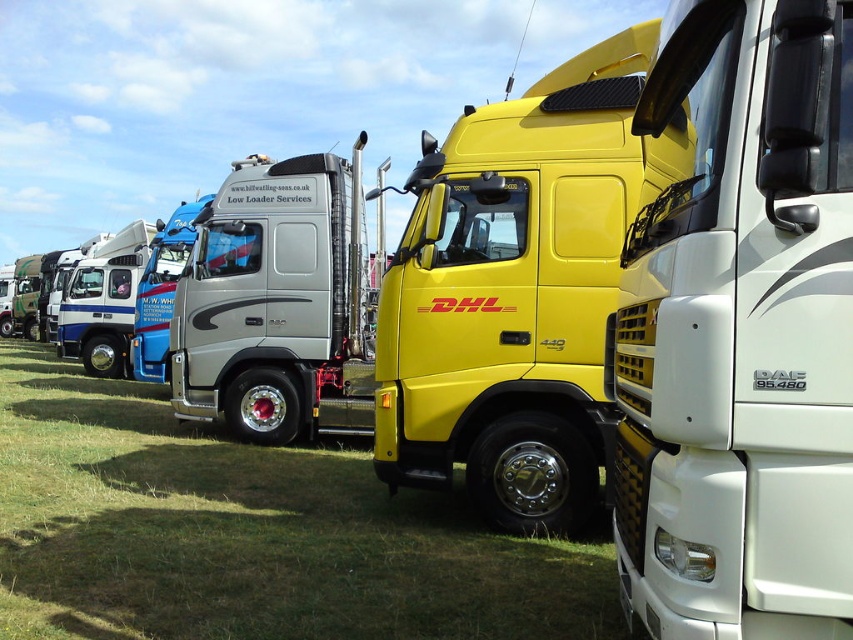
Is green grass at center positioned in front of yellow matte truck at center?

No, it is behind yellow matte truck at center.

The image size is (853, 640). In order to click on green grass at center in this screenshot , I will do `click(247, 534)`.

Is green grass at center smaller than silver metallic truck at center?

No.

Between point (6, 630) and point (231, 216), which one is positioned behind?

The point (231, 216) is more distant.

Where is `green grass at center`? This screenshot has height=640, width=853. green grass at center is located at coordinates (247, 534).

The width and height of the screenshot is (853, 640). Find the location of `white glossy trailer truck at center`. white glossy trailer truck at center is located at coordinates (740, 332).

In the scene shown: Can you confirm if white glossy trailer truck at center is wider than yellow matte truck at center?

Yes.

Find the location of a particular element. white glossy trailer truck at center is located at coordinates (740, 332).